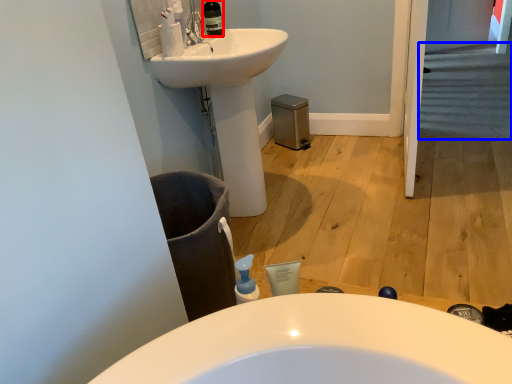
Question: Which of the following is the farthest to the observer, toiletry (highlighted by a red box) or stairs (highlighted by a blue box)?

Choices:
 (A) toiletry
 (B) stairs

Answer: (B)